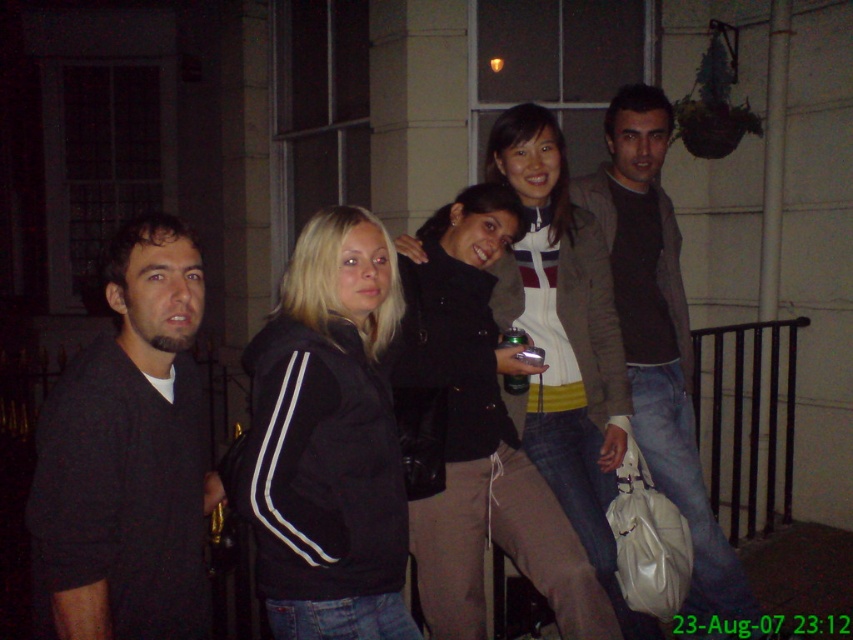
Question: Which object is farther from the camera taking this photo?

Choices:
 (A) black leather jacket at center
 (B) dark brown sweater at center
 (C) dark matte sweater at left
 (D) black fabric jacket at center

Answer: (B)

Question: Among these points, which one is nearest to the camera?

Choices:
 (A) (637, 381)
 (B) (527, 154)

Answer: (B)

Question: Does black fabric jacket at center appear on the left side of dark brown sweater at center?

Choices:
 (A) yes
 (B) no

Answer: (A)

Question: Does dark matte sweater at left have a larger size compared to black leather jacket at center?

Choices:
 (A) no
 (B) yes

Answer: (A)

Question: Which point appears farthest from the camera in this image?

Choices:
 (A) (598, 289)
 (B) (310, 618)

Answer: (A)

Question: From the image, what is the correct spatial relationship of black fabric jacket at center in relation to dark brown sweater at center?

Choices:
 (A) above
 (B) below

Answer: (B)